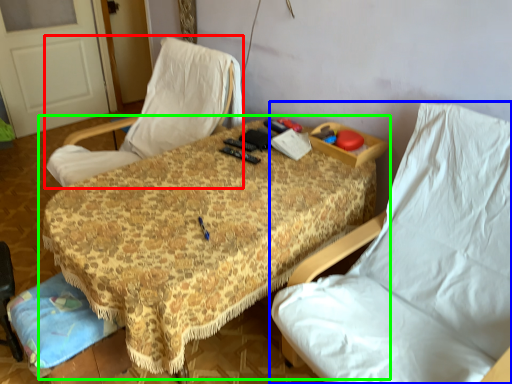
Question: Considering the real-world distances, which object is farthest from chair (highlighted by a red box)? chair (highlighted by a blue box) or table (highlighted by a green box)?

Choices:
 (A) chair
 (B) table

Answer: (A)